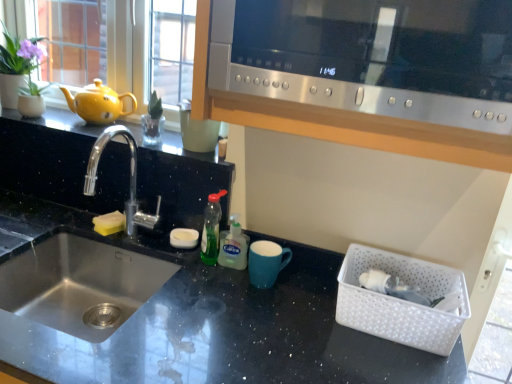
Where is `free spot to the left of green translucent bottle at center, which is counted as the 2th bottle, starting from the right`? Image resolution: width=512 pixels, height=384 pixels. free spot to the left of green translucent bottle at center, which is counted as the 2th bottle, starting from the right is located at coordinates (163, 246).